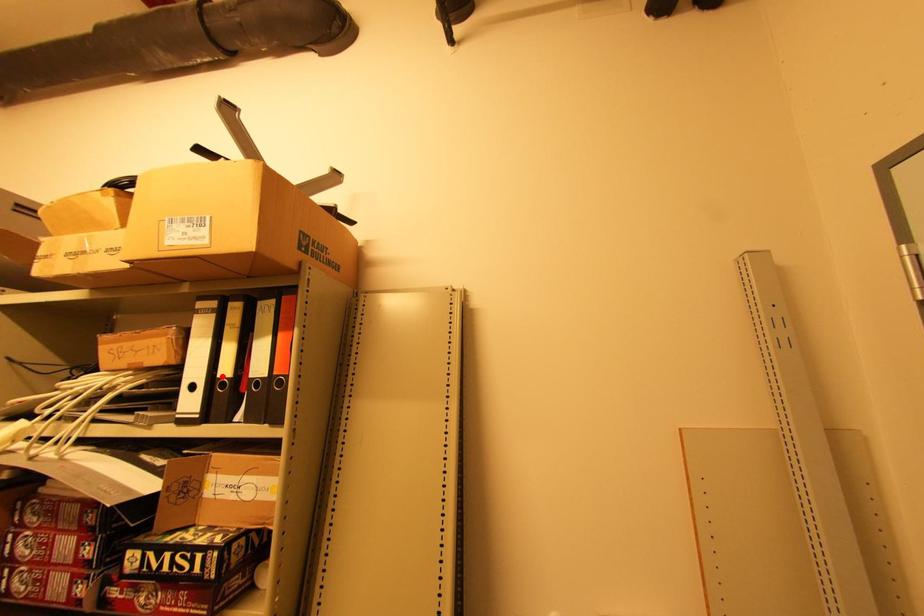
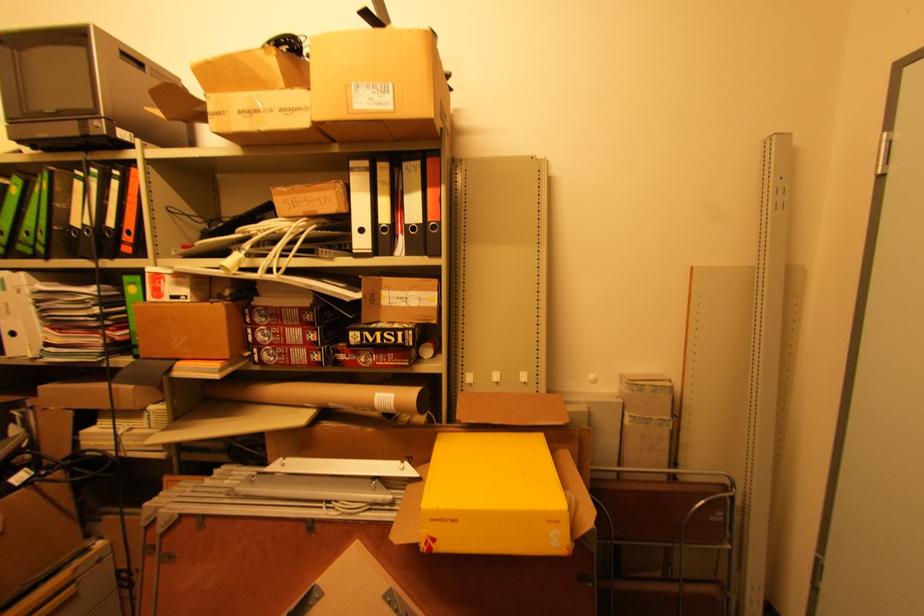
Locate, in the second image, the point that corresponds to the highlighted location in the first image.

(383, 223)